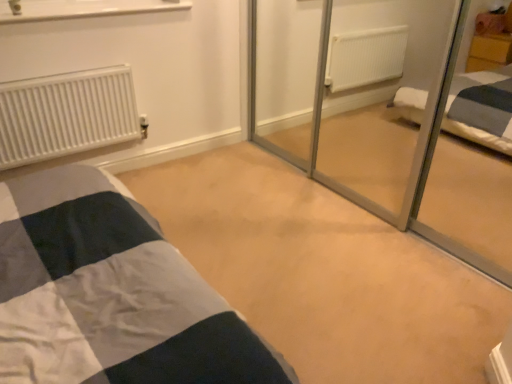
Where is `white matte radiator at left`? Image resolution: width=512 pixels, height=384 pixels. white matte radiator at left is located at coordinates (66, 115).

The width and height of the screenshot is (512, 384). What do you see at coordinates (66, 115) in the screenshot?
I see `white matte radiator at left` at bounding box center [66, 115].

What is the approximate height of white matte radiator at left?

white matte radiator at left is 18.92 inches in height.

You are a GUI agent. You are given a task and a screenshot of the screen. Output one action in this format:
    pyautogui.click(x=<x>, y=<y>)
    Task: Click on the white matte radiator at left
    
    Given the screenshot: What is the action you would take?
    pyautogui.click(x=66, y=115)